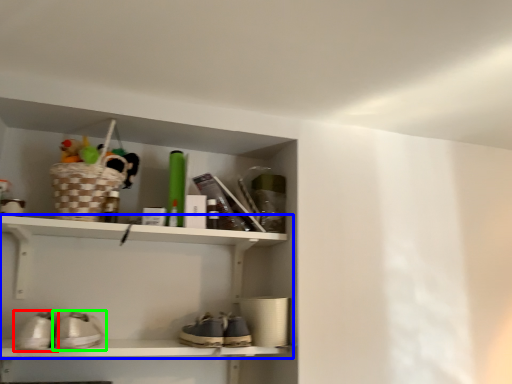
Question: Which is nearer to the footwear (highlighted by a red box)? shelf (highlighted by a blue box) or footwear (highlighted by a green box).

Choices:
 (A) shelf
 (B) footwear

Answer: (B)